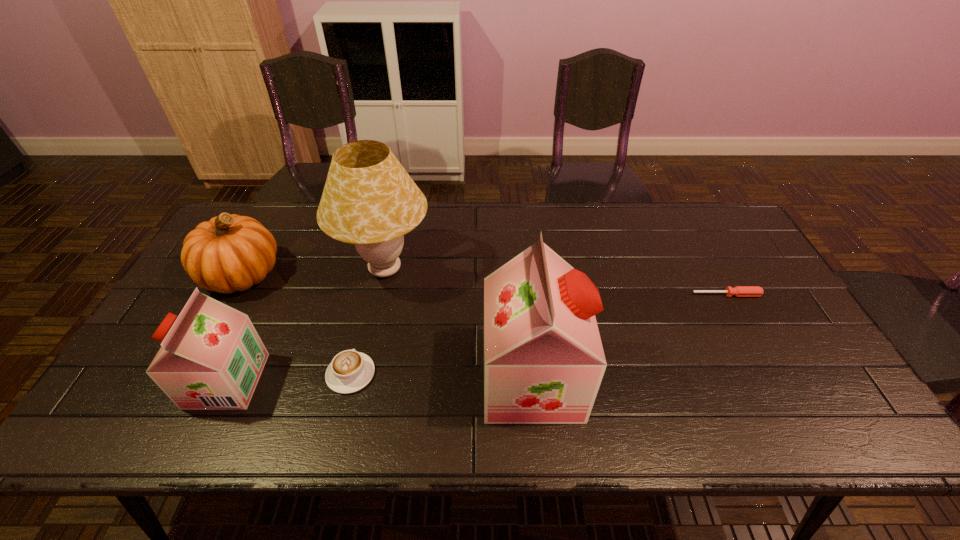
Image resolution: width=960 pixels, height=540 pixels. Identify the location of vacant space positioned 0.110m with the cap open on the left soya milk. (150, 381).

At what (x,y) coordinates should I click in order to perform the action: click on vacant area situated with the cap open on the second object from right to left. Please return your answer as a coordinate pair (x, y). Looking at the image, I should click on (628, 379).

This screenshot has width=960, height=540. I want to click on vacant space situated on the right of the lampshade, so coord(463,269).

In order to click on free spot located 0.170m on the left of the rightmost object in this screenshot , I will do `click(634, 295)`.

The image size is (960, 540). I want to click on vacant area located 0.320m on the right of the pumpkin, so click(389, 274).

Where is `vacant position located 0.120m with the handle on the right side of the cappuccino`? vacant position located 0.120m with the handle on the right side of the cappuccino is located at coordinates (364, 318).

This screenshot has height=540, width=960. Identify the location of vacant space located with the handle on the right side of the cappuccino. point(378,261).

This screenshot has width=960, height=540. Identify the location of vacant space located 0.070m with the handle on the right side of the cappuccino. (361, 332).

You are a GUI agent. You are given a task and a screenshot of the screen. Output one action in this format:
    pyautogui.click(x=<x>, y=<y>)
    Task: Click on the object located at the far edge
    
    Given the screenshot: What is the action you would take?
    pyautogui.click(x=369, y=200)

Locate an element on the screen. cappuccino that is positioned at the near edge is located at coordinates [x=350, y=371].